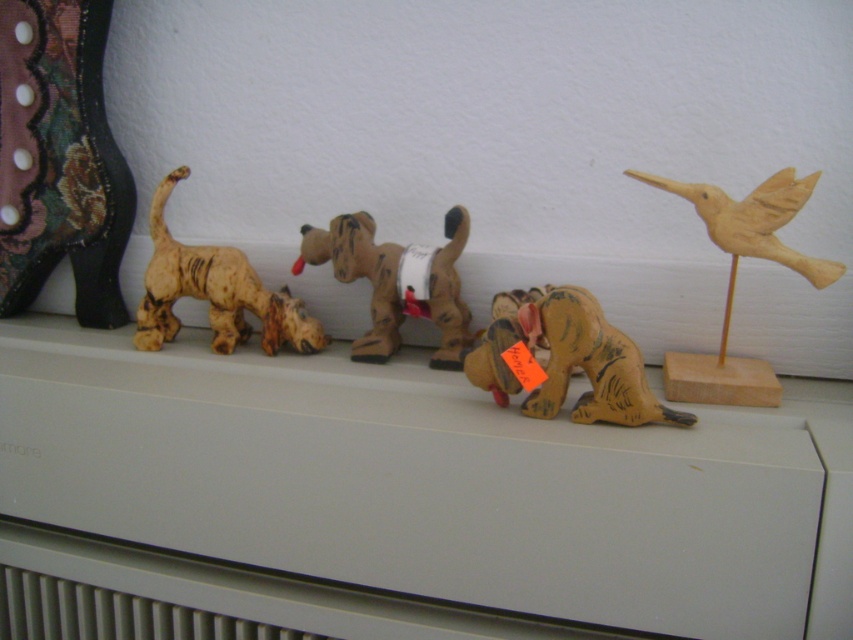
Does matte brown dog at center come behind wooden bird at right?

No.

Is point (607, 333) positioned before point (735, 360)?

Yes.

I want to click on matte brown dog at center, so click(564, 360).

Between matte brown shelf at upper center and wooden bird at right, which one has less height?

wooden bird at right

Identify the location of matte brown shelf at upper center. This screenshot has width=853, height=640. (434, 483).

Does matte brown shelf at upper center have a smaller size compared to brown matte dog at center?

No.

Is point (347, 548) more distant than point (309, 227)?

That is False.

Identify the location of matte brown shelf at upper center. (434, 483).